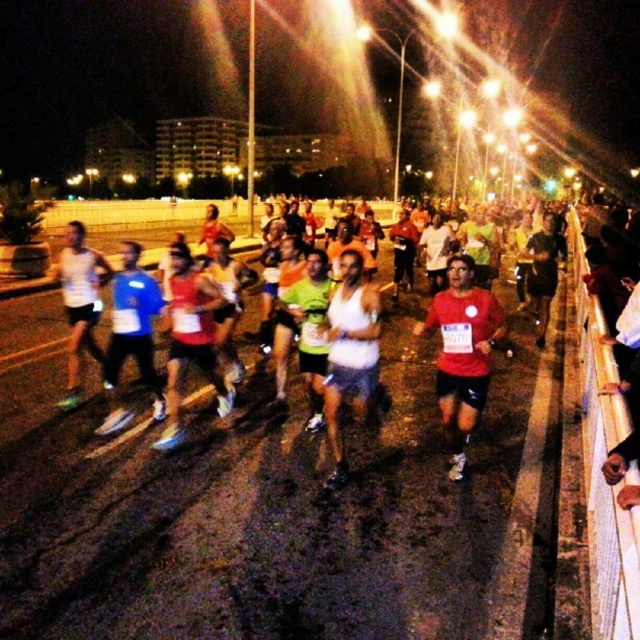
You are a runner participating in the marathon and wearing the red matte shirt at center. You want to check if you can safely reach the water bottle station located 20 feet ahead without interfering with the other runners. Based on your current position, can you make it?

The red matte shirt at center and viewer are 16.50 feet apart. Since the water bottle station is 20 feet ahead, you are within a safe distance to reach it without interfering with others, provided there is no sudden obstruction.

You are a runner in the marathon and you want to pass through the gap between the white fabric tank top at center and the metal railing on the right. Can you fit through the gap?

The gap between the white fabric tank top at center and the metal railing on the right is 5.25 meters, so yes, you can easily fit through the gap as it is sufficiently wide for a runner to pass through.

Looking at this image, you are a photographer at the marathon event. You notice two runners wearing white tank tops at the center of the image. One is labeled as white fabric tank top at center and the other as white matte tank top at center. Which runner is closer to the camera?

The white fabric tank top at center is positioned over the white matte tank top at center, meaning the runner wearing the white fabric tank top at center is closer to the camera.